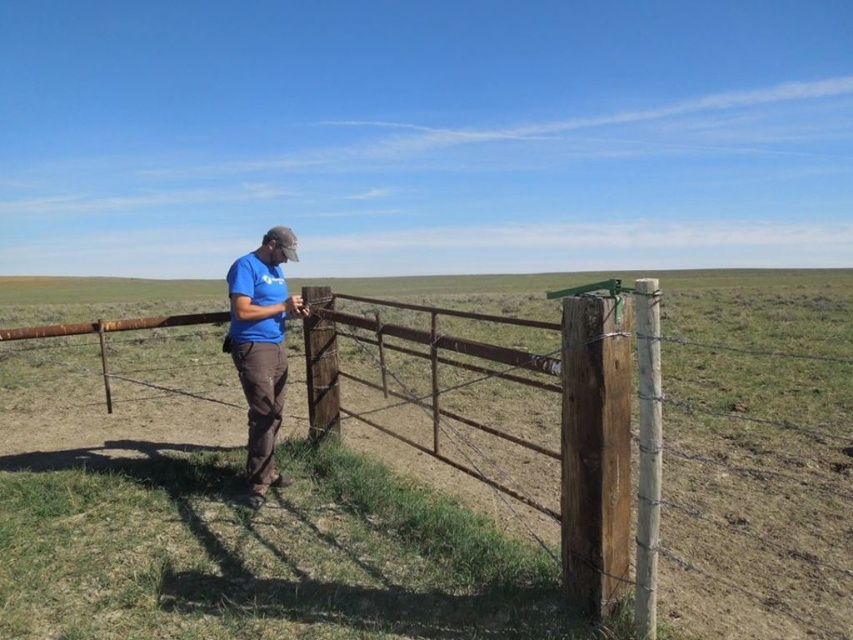
Can you confirm if rusty metal fence at center is smaller than blue cotton shirt at center?

No, rusty metal fence at center is not smaller than blue cotton shirt at center.

Does rusty metal fence at center have a greater height compared to blue cotton shirt at center?

Yes.

Between point (91, 332) and point (274, 237), which one is positioned behind?

The point (91, 332) is more distant.

In order to click on rusty metal fence at center in this screenshot , I will do `click(210, 513)`.